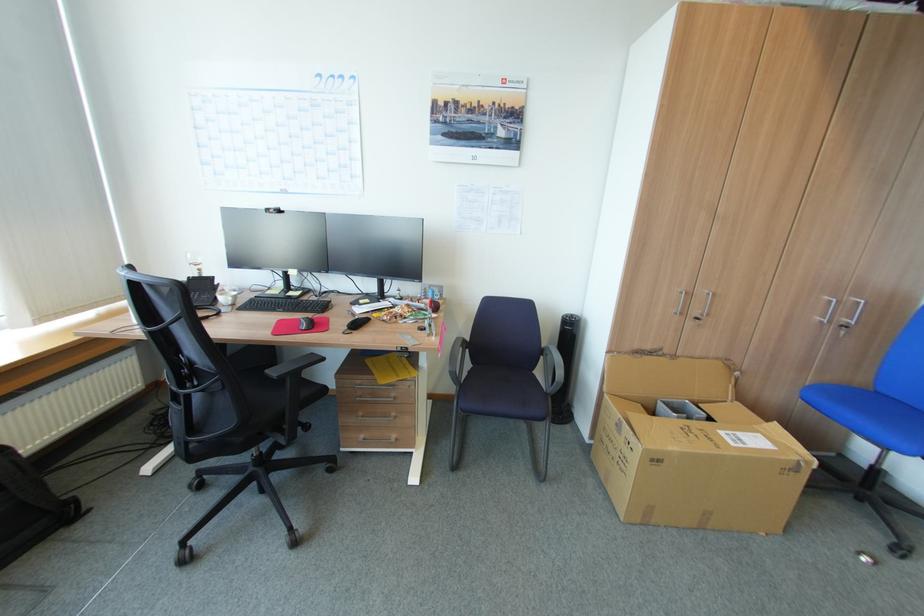
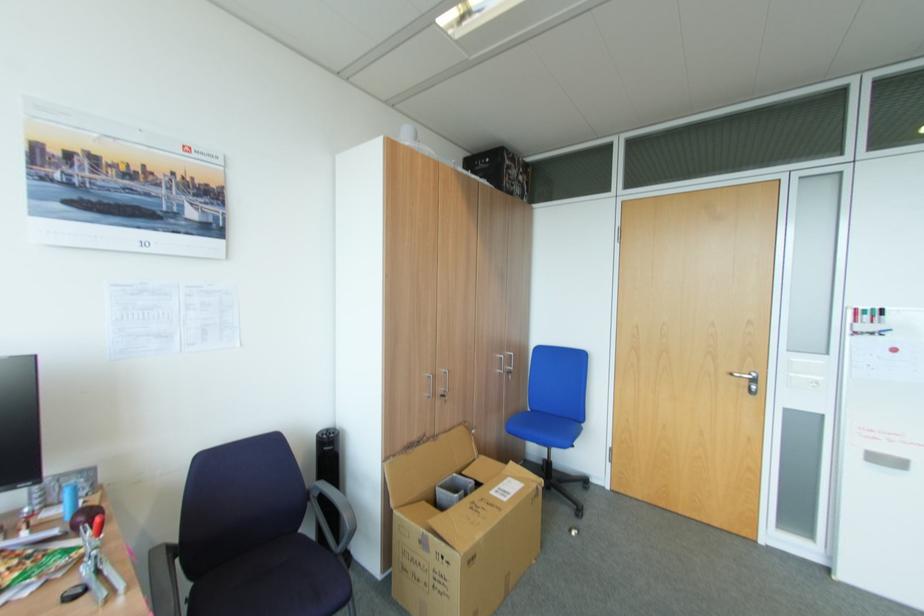
Where in the second image is the point corresponding to (663,461) from the first image?

(479, 556)